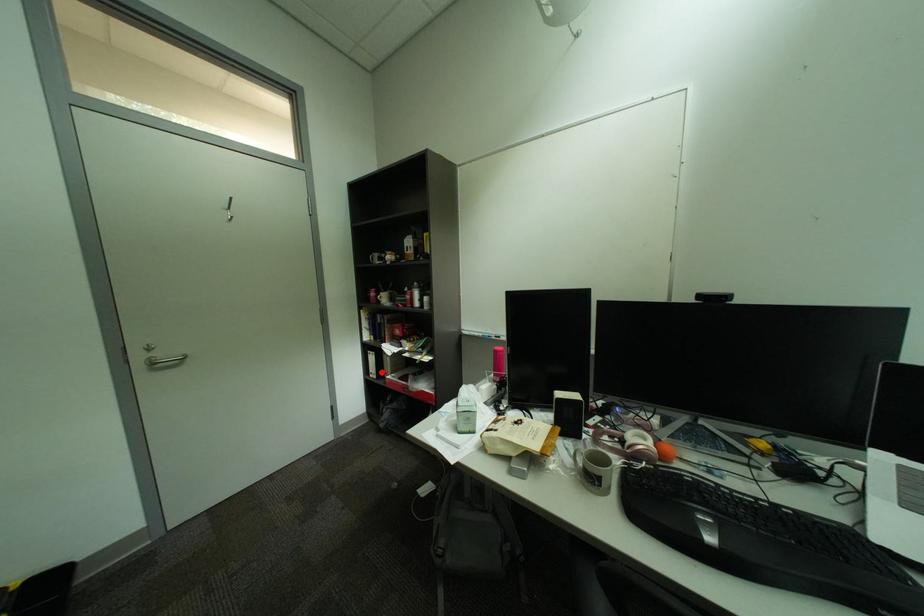
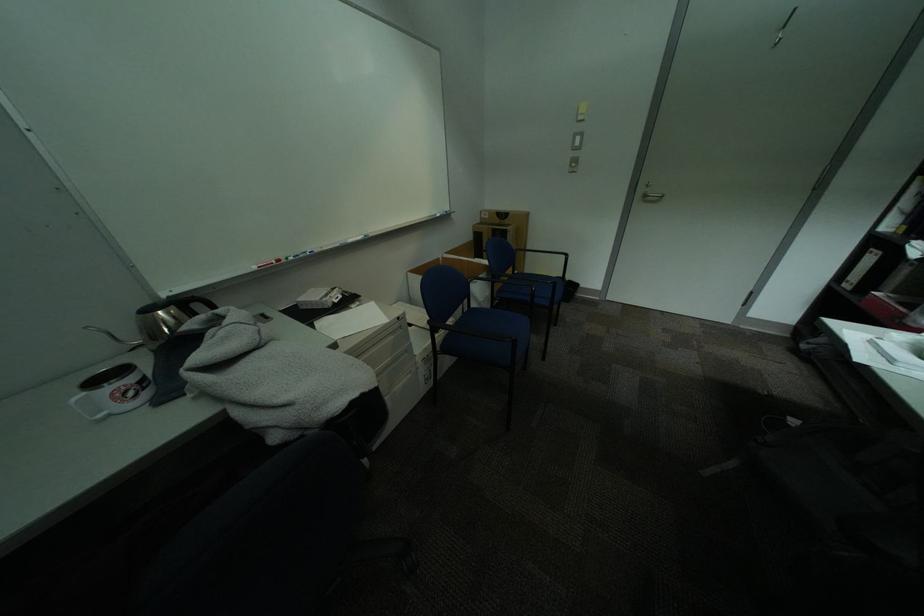
Locate, in the second image, the point that corresponds to the highlighted location in the first image.

(859, 280)